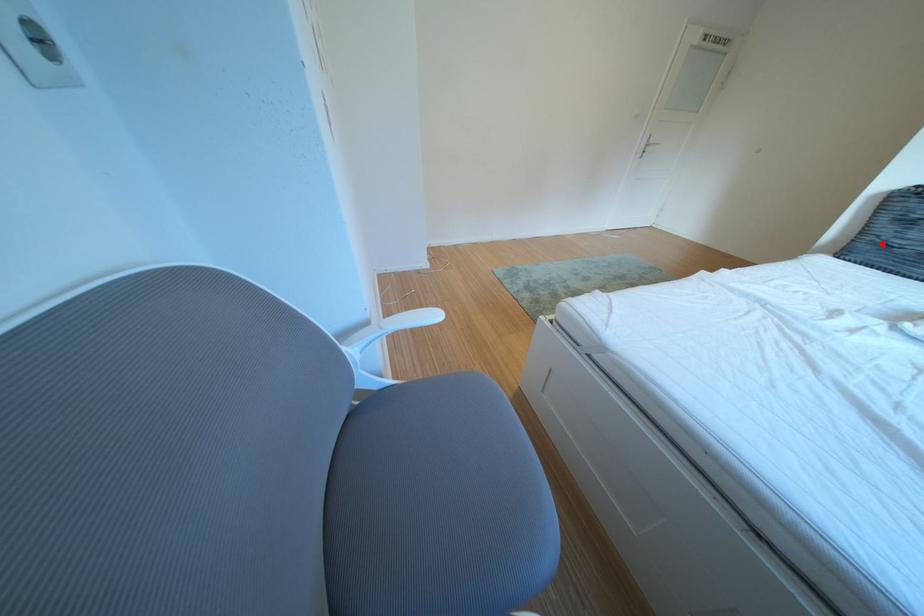
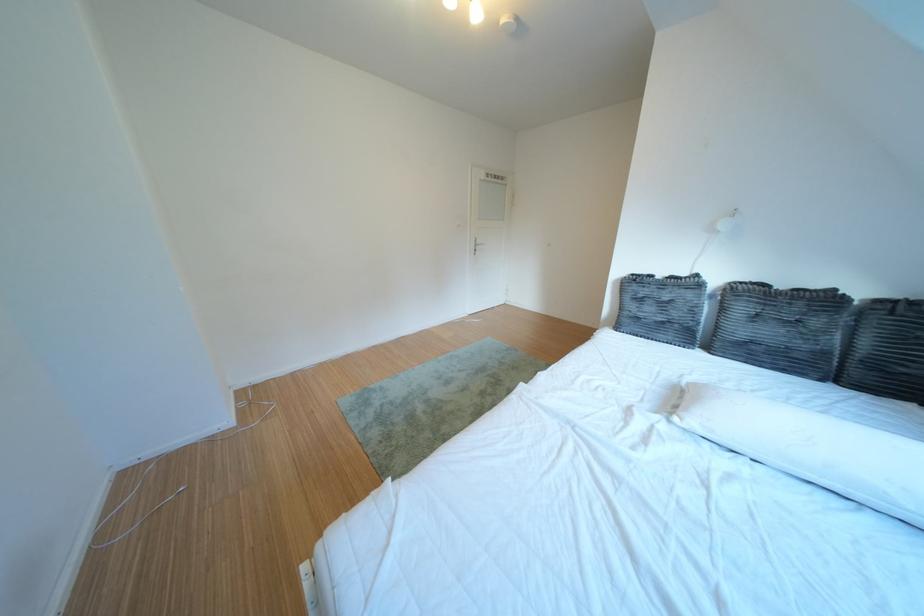
Question: I am providing you with two images of the same scene from different viewpoints. Image1 has a red point marked. In image2, the corresponding 3D location appears at what relative position? Reply with the corresponding letter.

Choices:
 (A) Closer
 (B) Farther

Answer: (A)